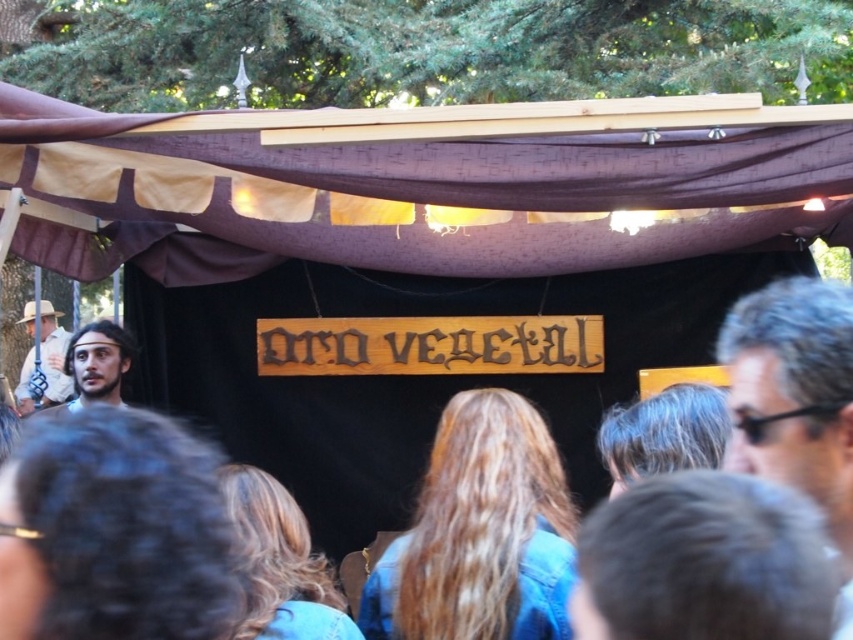
Question: Which point is closer to the camera?

Choices:
 (A) smooth brown hair at center
 (B) gray hair at right

Answer: (B)

Question: Does gray hair at right lie in front of matte brown hat at left?

Choices:
 (A) no
 (B) yes

Answer: (B)

Question: Does brown fabric canopy at upper center have a greater width compared to gray hair at right?

Choices:
 (A) no
 (B) yes

Answer: (B)

Question: Among these objects, which one is nearest to the camera?

Choices:
 (A) matte brown hat at left
 (B) brown fabric canopy at upper center
 (C) smooth brown hair at center

Answer: (B)

Question: Can you confirm if gray hair at right is positioned to the left of smooth brown hair at center?

Choices:
 (A) yes
 (B) no

Answer: (B)

Question: Which of the following is the farthest from the observer?

Choices:
 (A) matte brown hat at left
 (B) smooth brown hair at center
 (C) gray hair at right

Answer: (A)